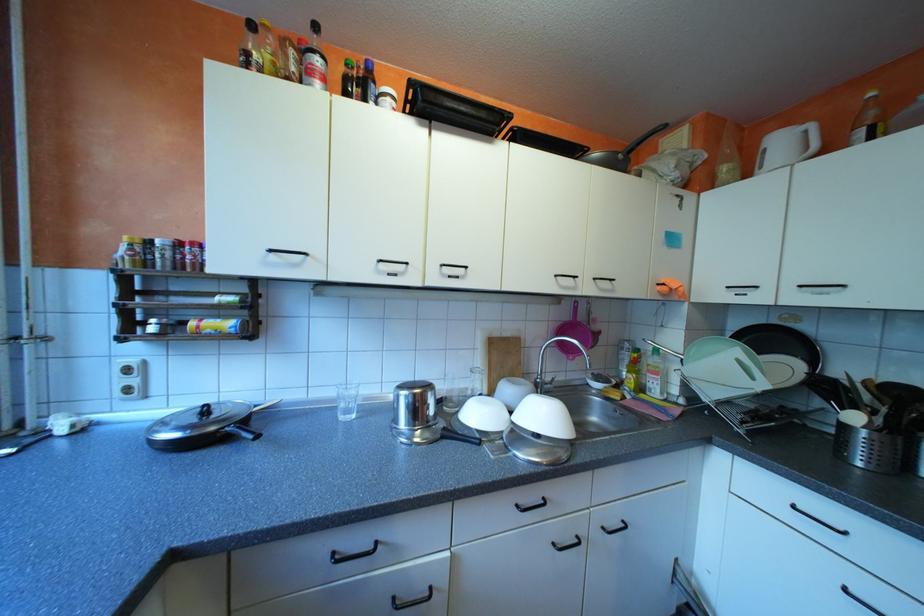
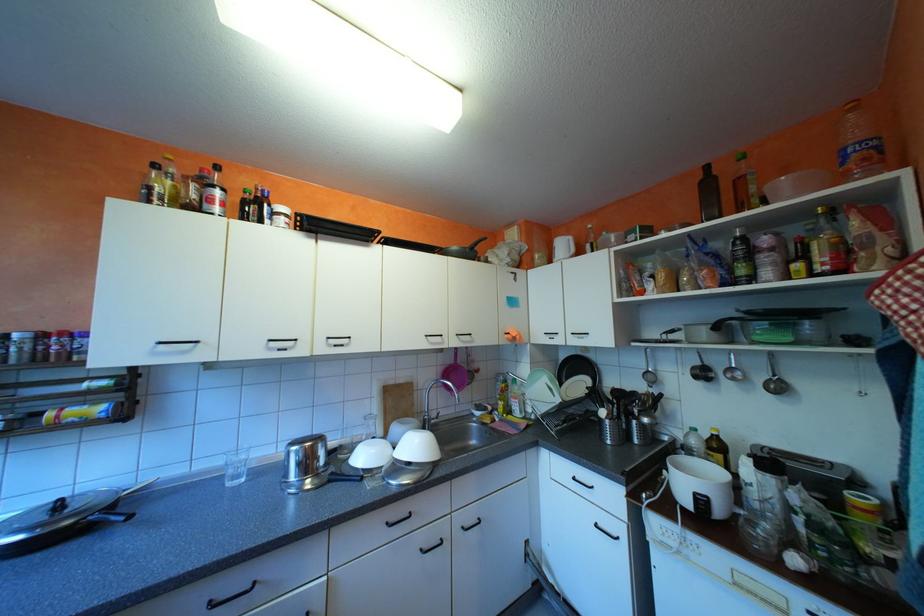
The images are taken continuously from a first-person perspective. In which direction are you moving?

The cameraman walked toward right, backward.